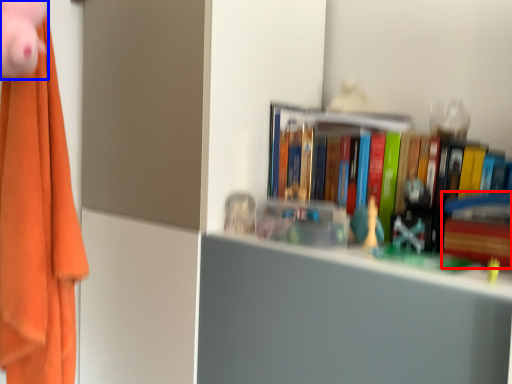
Question: Which object is closer to the camera taking this photo, paperback book (highlighted by a red box) or toy (highlighted by a blue box)?

Choices:
 (A) paperback book
 (B) toy

Answer: (B)